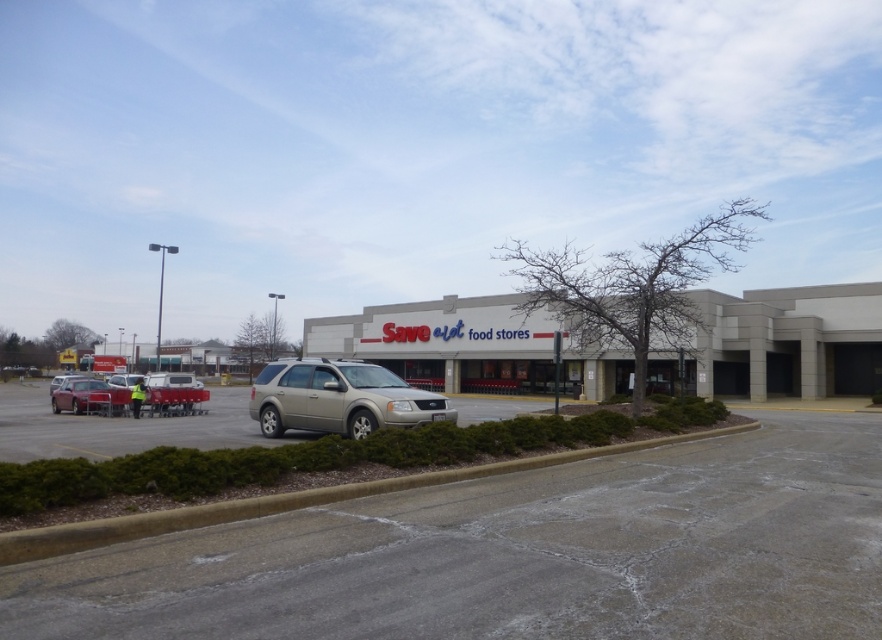
Who is more distant from viewer, (539, 378) or (96, 429)?

The point (539, 378) is more distant.

Describe the element at coordinates (787, 342) in the screenshot. Image resolution: width=882 pixels, height=640 pixels. I see `white concrete mall at center` at that location.

Between point (746, 378) and point (13, 388), which one is positioned in front?

Point (746, 378) is more forward.

I want to click on white concrete mall at center, so click(787, 342).

Between point (542, 388) and point (114, 408), which one is positioned behind?

Positioned behind is point (542, 388).

Can you confirm if white concrete mall at center is positioned above matte red car at left?

Indeed, white concrete mall at center is positioned over matte red car at left.

The image size is (882, 640). I want to click on white concrete mall at center, so click(787, 342).

This screenshot has width=882, height=640. What are the coordinates of `white concrete mall at center` in the screenshot? It's located at (787, 342).

Which of these two, matte silver suv at center or matte silver suv at left, stands shorter?

With less height is matte silver suv at center.

Can you confirm if matte silver suv at center is thinner than matte silver suv at left?

Correct, matte silver suv at center's width is less than matte silver suv at left's.

What do you see at coordinates (128, 396) in the screenshot? I see `matte silver suv at center` at bounding box center [128, 396].

This screenshot has height=640, width=882. Find the location of `matte silver suv at center`. matte silver suv at center is located at coordinates (128, 396).